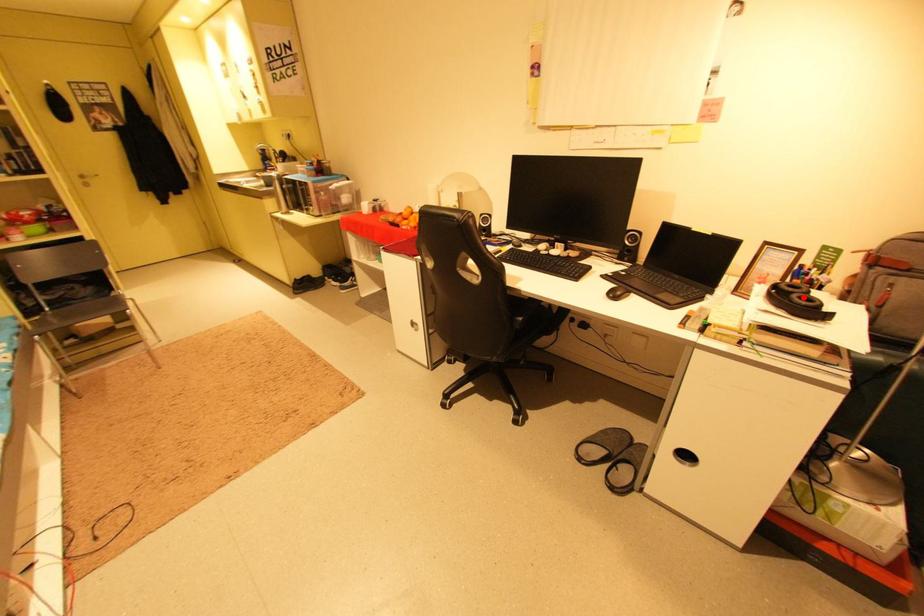
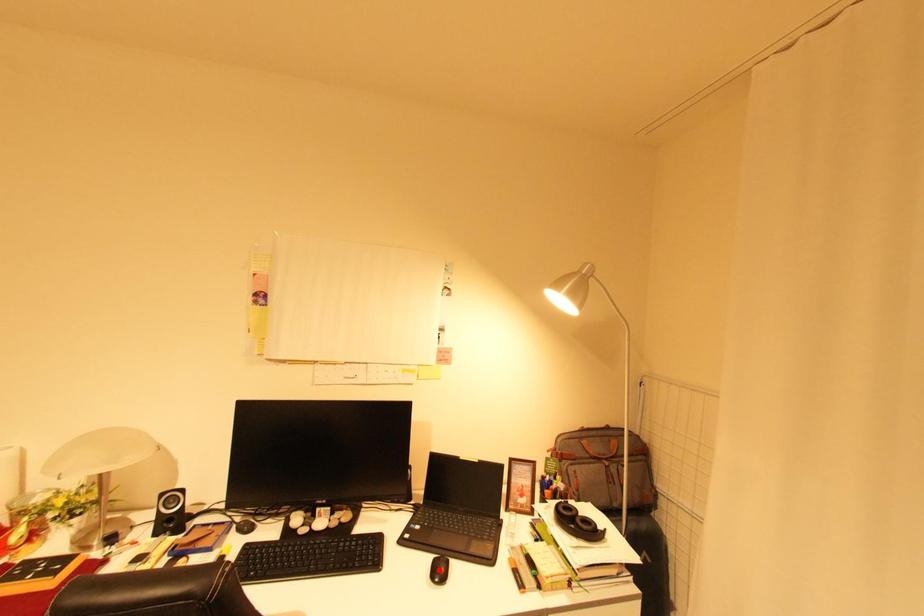
I am providing you with two images of the same scene from different viewpoints. A red point is marked on the first image and another point is marked on the second image. Is the red point in image1 aligned with the point shown in image2?

No